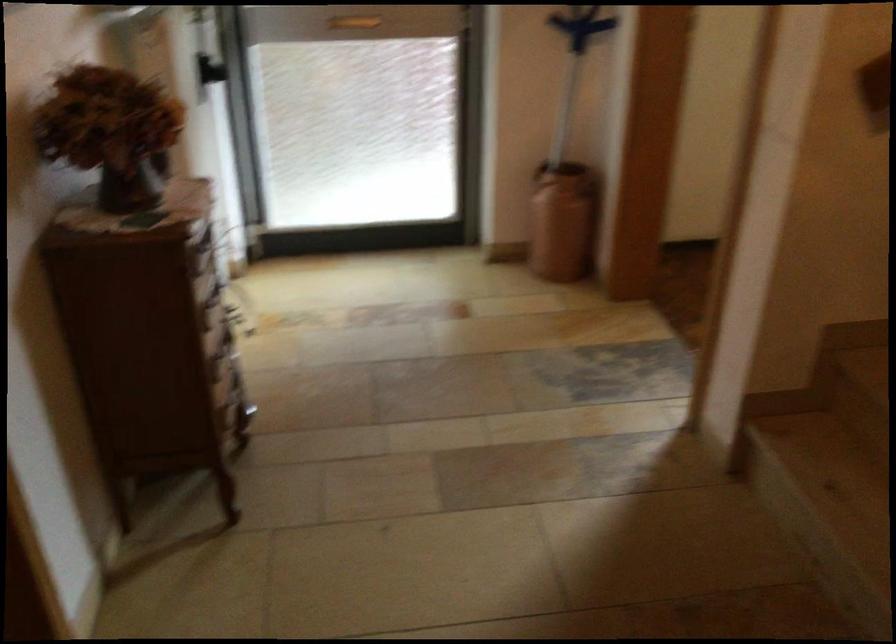
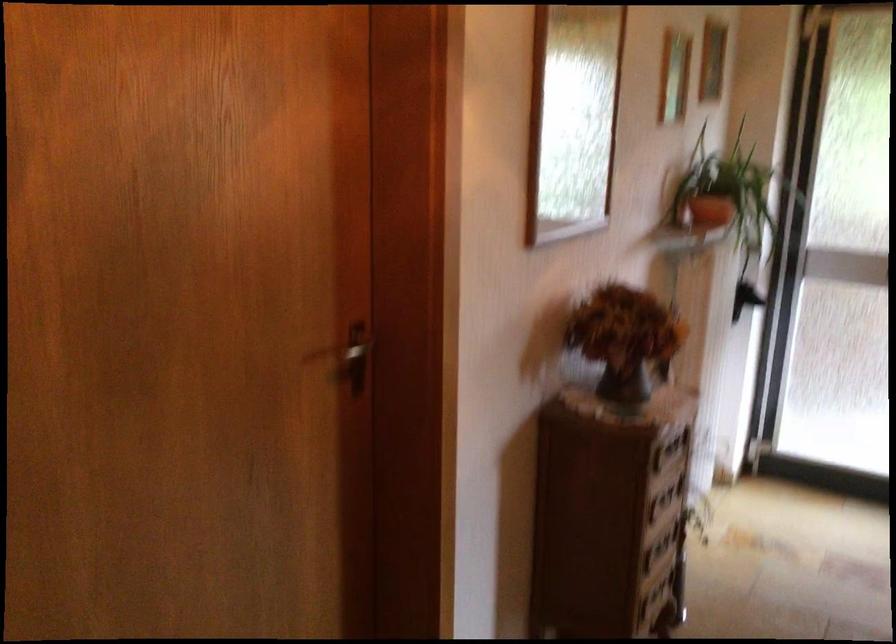
In the second image, find the point that corresponds to (x=211, y=305) in the first image.

(659, 504)